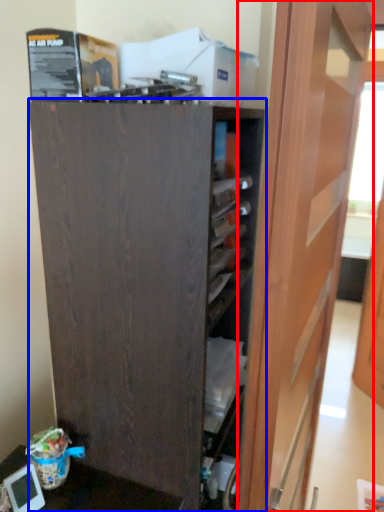
Question: Among these objects, which one is nearest to the camera, door (highlighted by a red box) or cupboard (highlighted by a blue box)?

Choices:
 (A) door
 (B) cupboard

Answer: (A)